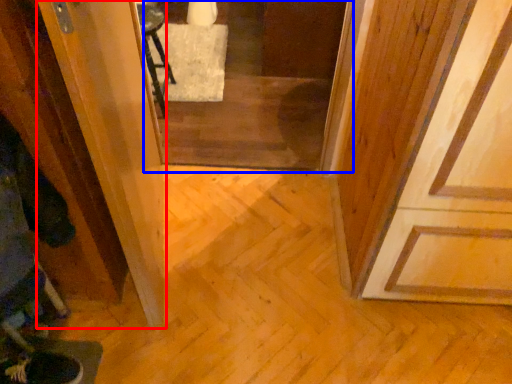
Question: Which object is closer to the camera taking this photo, screen door (highlighted by a red box) or screen door (highlighted by a blue box)?

Choices:
 (A) screen door
 (B) screen door

Answer: (A)